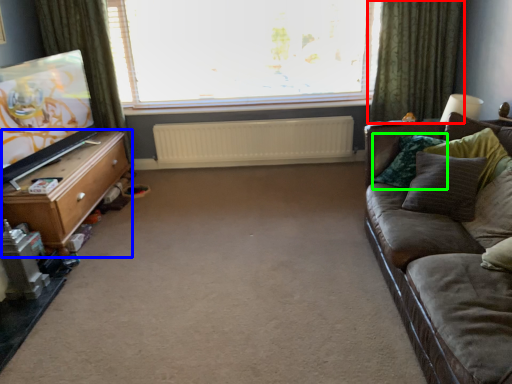
Question: Which object is positioned closest to curtain (highlighted by a red box)? Select from table (highlighted by a blue box) and pillow (highlighted by a green box).

Choices:
 (A) table
 (B) pillow

Answer: (B)